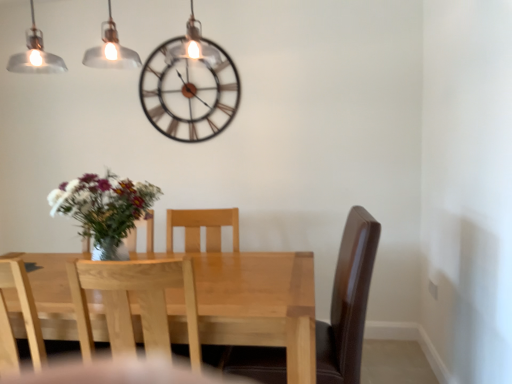
The image size is (512, 384). Find the location of `empty space that is ontop of metallic brown clock at upper center`. empty space that is ontop of metallic brown clock at upper center is located at coordinates (180, 38).